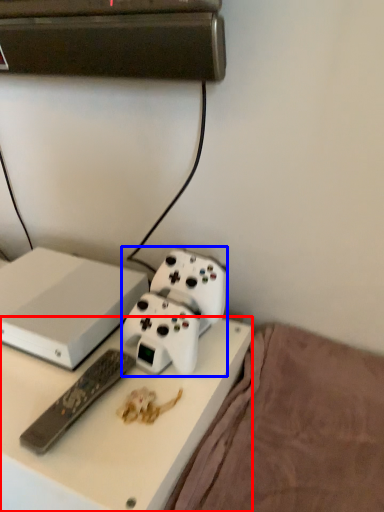
Question: Which object appears closest to the camera in this image, desk (highlighted by a red box) or equipment (highlighted by a blue box)?

Choices:
 (A) desk
 (B) equipment

Answer: (A)